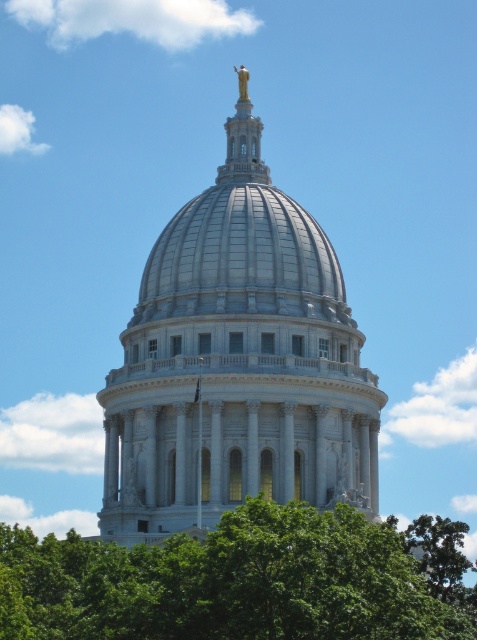
Question: Which point is farther to the camera?

Choices:
 (A) white marble dome at center
 (B) green leafy tree at lower center

Answer: (A)

Question: Observing the image, what is the correct spatial positioning of green leafy tree at lower center in reference to goldmaterial/texturestatue at upper center?

Choices:
 (A) below
 (B) above

Answer: (A)

Question: Considering the real-world distances, which object is farthest from the goldmaterial/texturestatue at upper center?

Choices:
 (A) green leafy tree at lower center
 (B) white marble dome at center

Answer: (A)

Question: Considering the relative positions of white marble dome at center and goldmaterial/texturestatue at upper center in the image provided, where is white marble dome at center located with respect to goldmaterial/texturestatue at upper center?

Choices:
 (A) left
 (B) right

Answer: (A)

Question: Does green leafy tree at lower center appear on the right side of goldmaterial/texturestatue at upper center?

Choices:
 (A) no
 (B) yes

Answer: (A)

Question: Which point is farther from the camera taking this photo?

Choices:
 (A) (249, 156)
 (B) (260, 576)

Answer: (A)